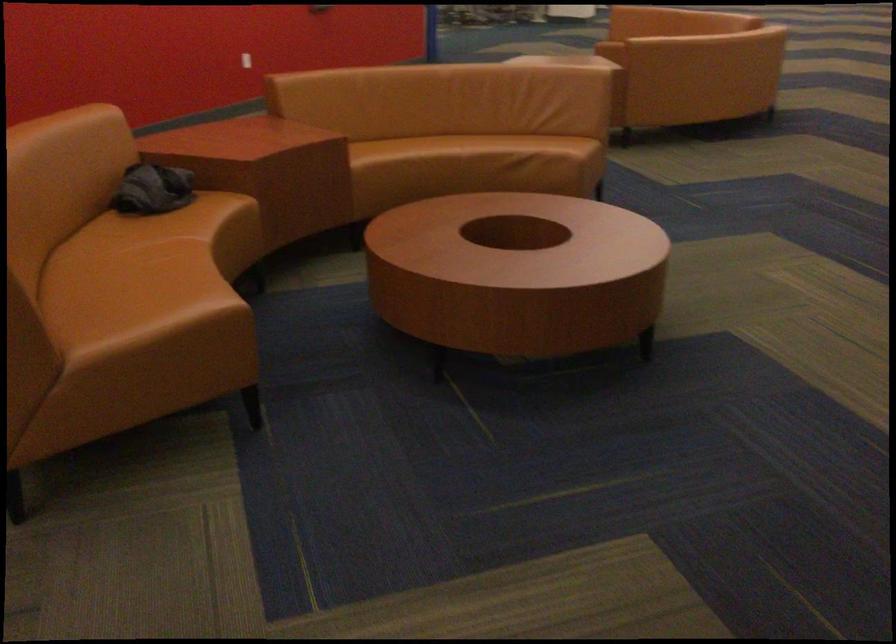
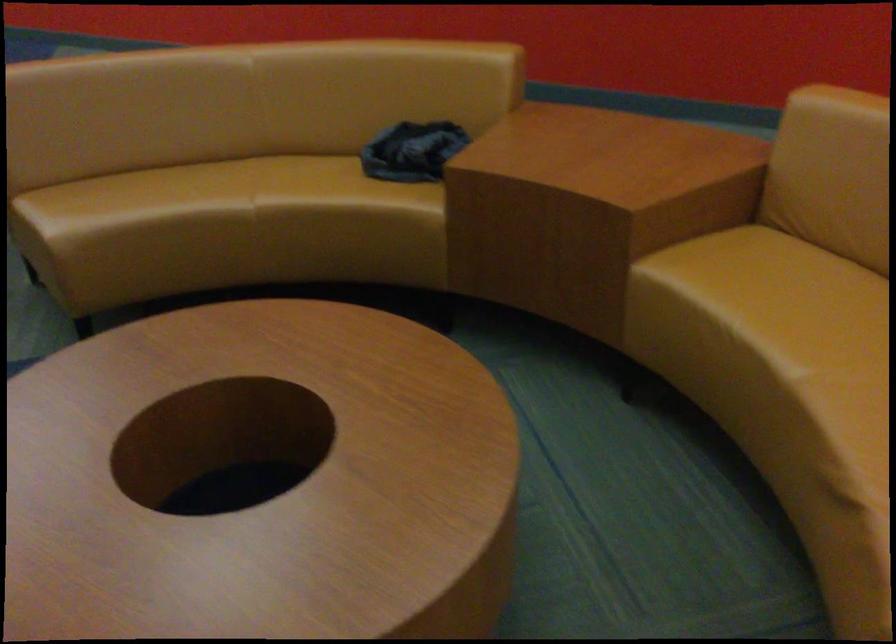
Find the pixel in the second image that matches (x=211, y=254) in the first image.

(255, 220)